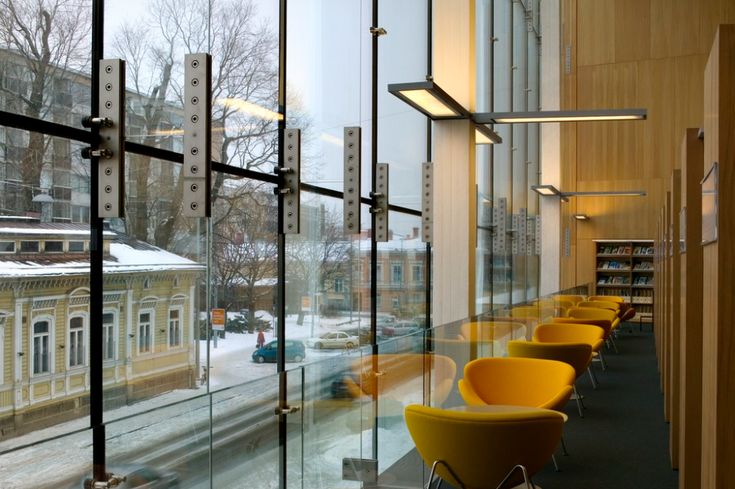
The height and width of the screenshot is (489, 735). Find the location of `wood beam`. wood beam is located at coordinates pyautogui.click(x=456, y=214).